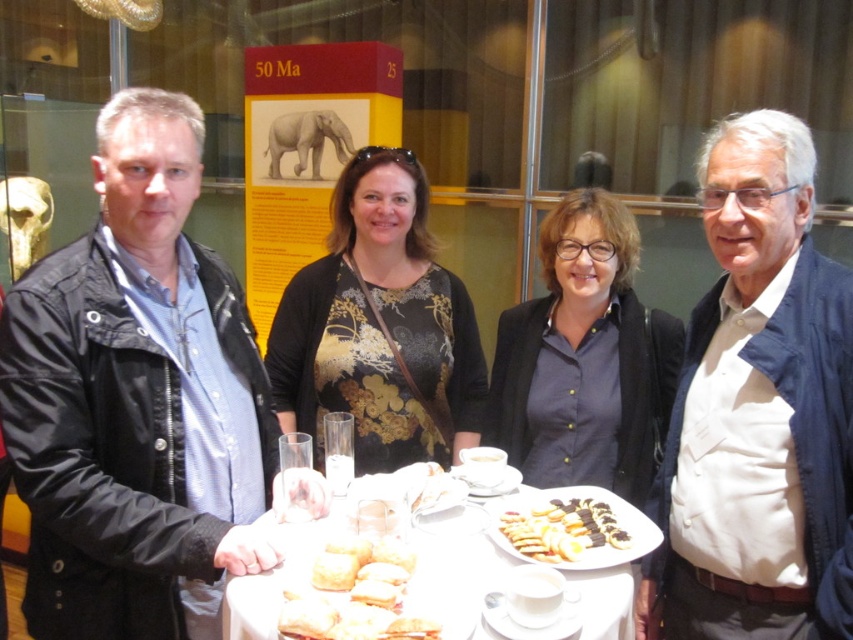
Consider the image. Which is more to the left, white porcelain plate at center or golden brown flaky pastry at center?

golden brown flaky pastry at center is more to the left.

This screenshot has height=640, width=853. I want to click on white porcelain plate at center, so click(x=456, y=579).

Based on the photo, which is more to the left, dark blue shirt at center or white porcelain plate at center?

white porcelain plate at center is more to the left.

Does dark blue shirt at center appear under white porcelain plate at center?

No.

This screenshot has height=640, width=853. What do you see at coordinates (585, 358) in the screenshot?
I see `dark blue shirt at center` at bounding box center [585, 358].

The image size is (853, 640). What are the coordinates of `dark blue shirt at center` in the screenshot? It's located at (585, 358).

Can you confirm if black floral dress at center is positioned above white porcelain plate at center?

Correct, black floral dress at center is located above white porcelain plate at center.

Which of these two, black floral dress at center or white porcelain plate at center, stands taller?

black floral dress at center

This screenshot has height=640, width=853. I want to click on black floral dress at center, so click(x=379, y=326).